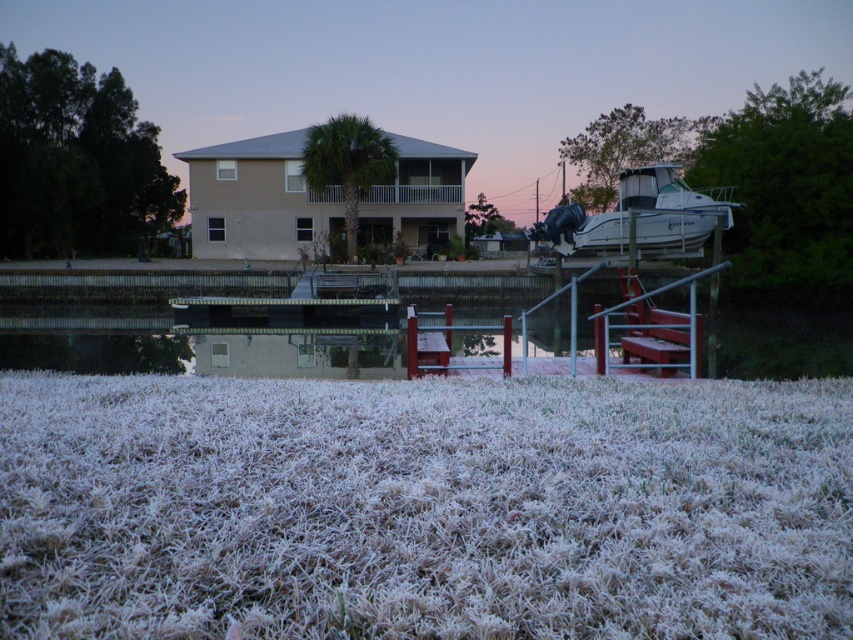
Question: Observing the image, what is the correct spatial positioning of frosted grass at lower center in reference to white glossy boat at right?

Choices:
 (A) left
 (B) right

Answer: (A)

Question: Which object is closer to the camera taking this photo?

Choices:
 (A) frosted grass at lower center
 (B) white glossy boat at right

Answer: (A)

Question: Can you confirm if frosted grass at lower center is positioned above white glossy boat at right?

Choices:
 (A) yes
 (B) no

Answer: (B)

Question: Which object is farther from the camera taking this photo?

Choices:
 (A) frosted grass at lower center
 (B) white glossy boat at right

Answer: (B)

Question: Is frosted grass at lower center further to the viewer compared to white glossy boat at right?

Choices:
 (A) no
 (B) yes

Answer: (A)

Question: Which of the following is the closest to the observer?

Choices:
 (A) frosted grass at lower center
 (B) white glossy boat at right

Answer: (A)